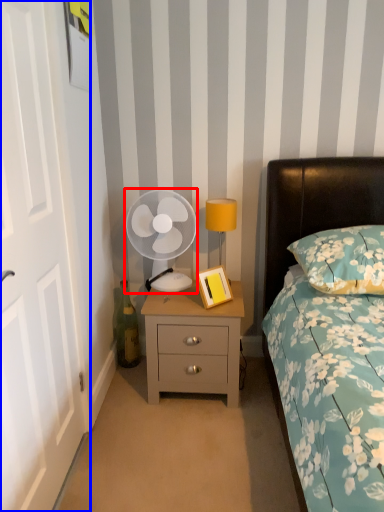
Question: Among these objects, which one is nearest to the camera, mechanical fan (highlighted by a red box) or door (highlighted by a blue box)?

Choices:
 (A) mechanical fan
 (B) door

Answer: (B)